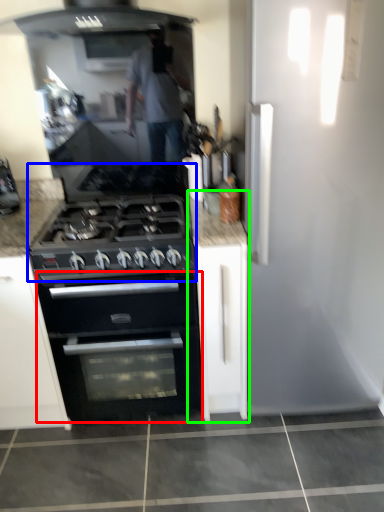
Question: Which is farther away from oven (highlighted by a red box)? gas stove (highlighted by a blue box) or cabinetry (highlighted by a green box)?

Choices:
 (A) gas stove
 (B) cabinetry

Answer: (A)